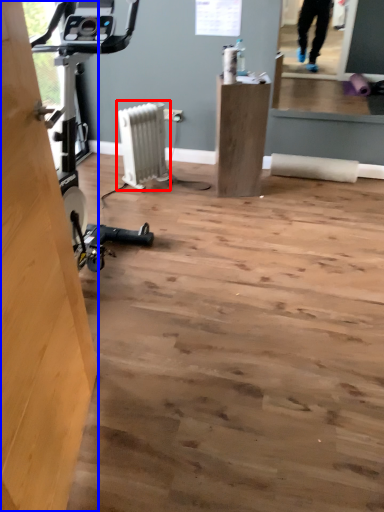
Question: Which of the following is the closest to the observer, radiator (highlighted by a red box) or plywood (highlighted by a blue box)?

Choices:
 (A) radiator
 (B) plywood

Answer: (B)